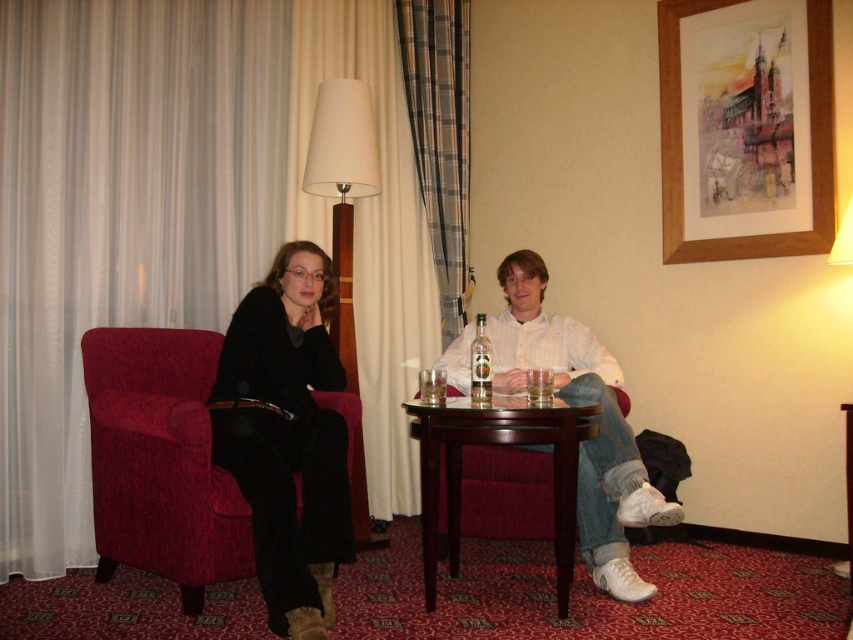
You are standing in the hotel room and want to place a 2.5 meter long banner on the floor between you and the mahogany wood table at center. Is the distance sufficient to lay the banner flat without folding it?

The mahogany wood table at center is 2.30 meters away from viewer. Since the banner is 2.5 meters long, the distance is insufficient. The banner cannot be laid flat without folding.

You are standing in the hotel room and want to place a 6 feet long sofa. The sofa must be placed such that its center is exactly at point (x=642, y=508). Is there enough space to place the sofa without it extending beyond the room boundaries?

The distance of point (x=642, y=508) from camera is 8.00 feet. Since the sofa is 6 feet long, and the point is 8 feet away from the camera, there is sufficient space to place the sofa at that point without it extending beyond the room boundaries.